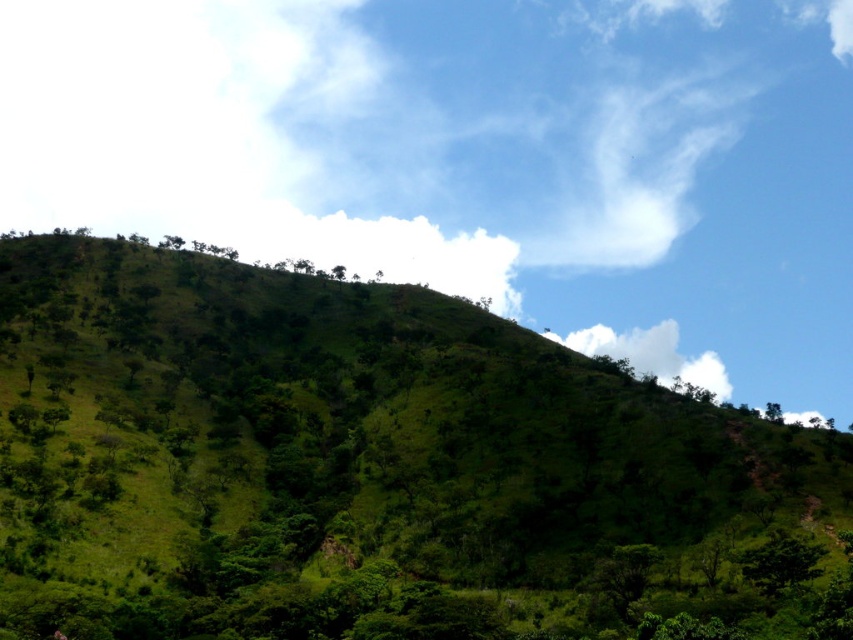
Looking at this image, you are a hiker standing at the base of the green leafy hillside at center. You want to reach the top of the hillside. Considering the distance between you and the hillside is 59.22 meters, can you estimate how long it would take you to climb to the top if your average climbing speed is 1.5 meters per minute?

The distance between you and the green leafy hillside at center is 59.22 meters. At an average climbing speed of 1.5 meters per minute, it would take approximately 39.48 minutes to reach the top.

Consider the image. You are standing on the lush green hillside and looking up at the sky. There is a point marked at coordinates point (651, 353). What is the object located at this point?

The point (651, 353) is located on the white fluffy cloud at upper center.